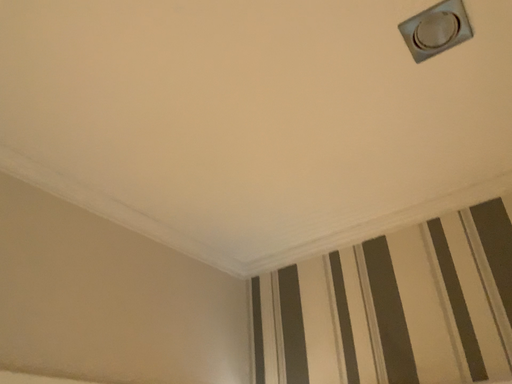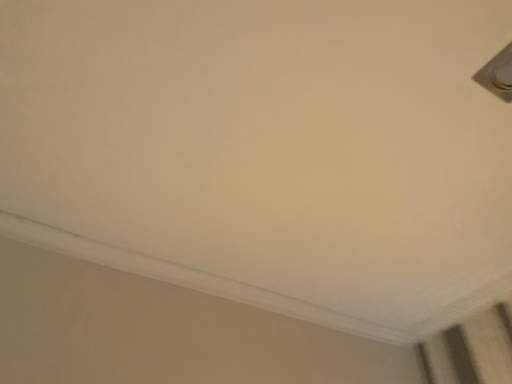
Question: How did the camera likely rotate when shooting the video?

Choices:
 (A) rotated right
 (B) rotated left

Answer: (B)